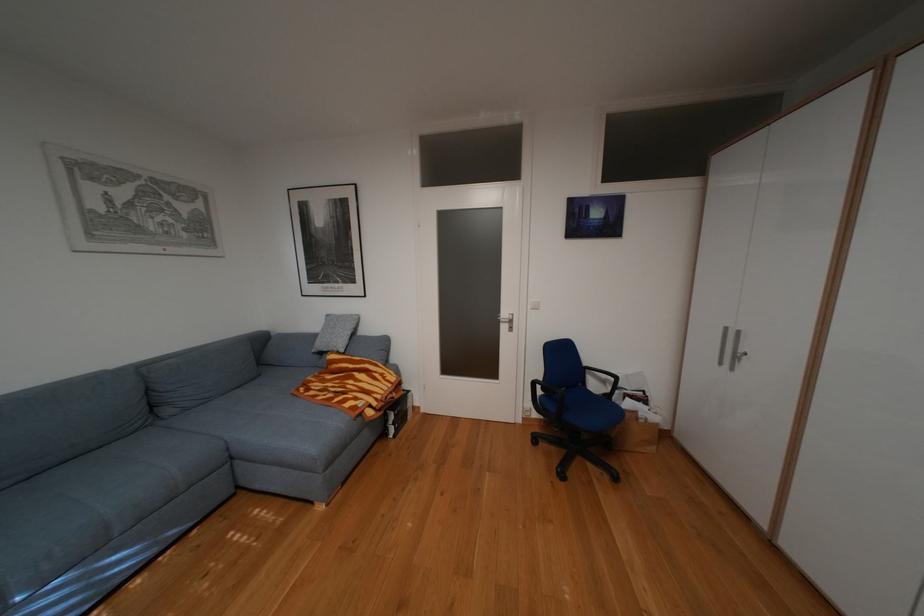
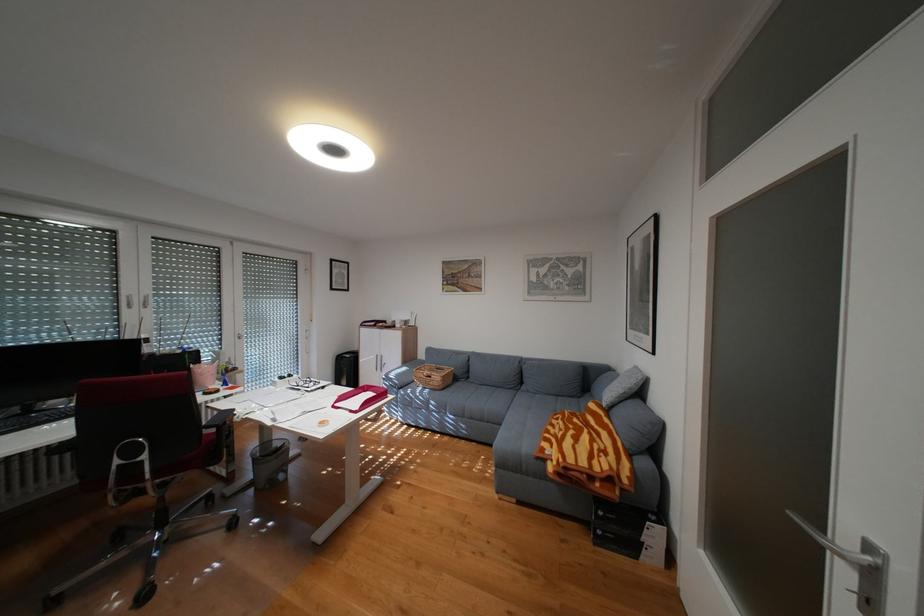
Where in the second image is the point corresponding to pixel 369 398 from the first image?

(564, 445)